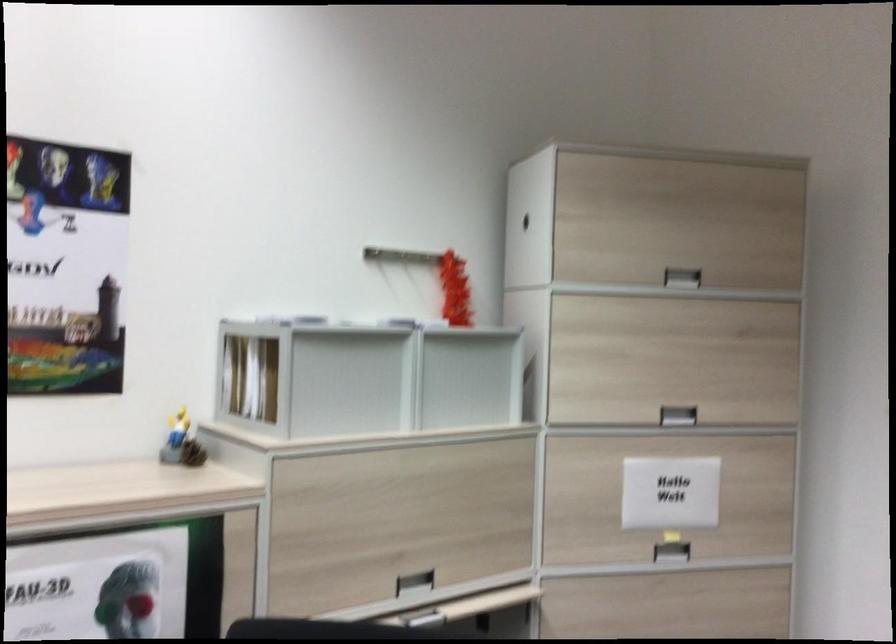
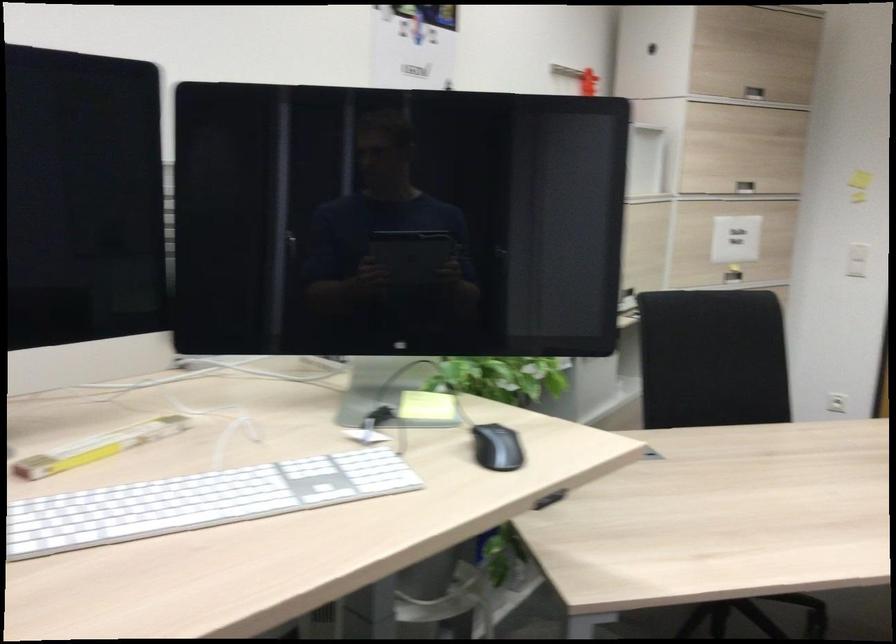
Find the pixel in the second image that matches pixel 428 263 in the first image.

(579, 78)